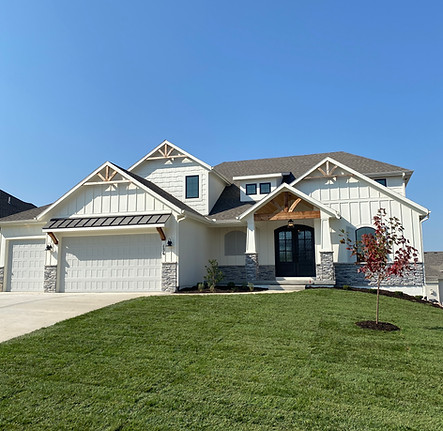
Locate an element on the screen. window is located at coordinates (193, 179).